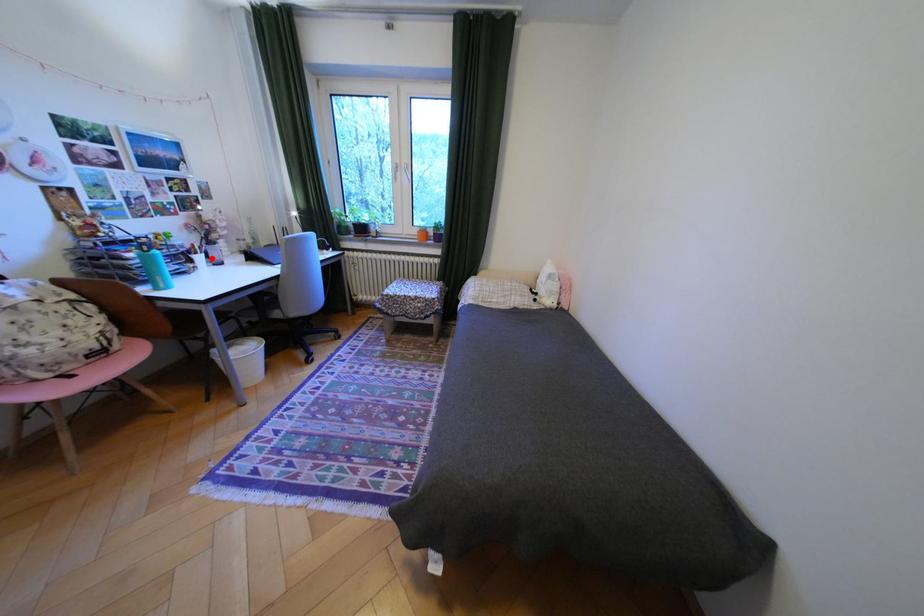
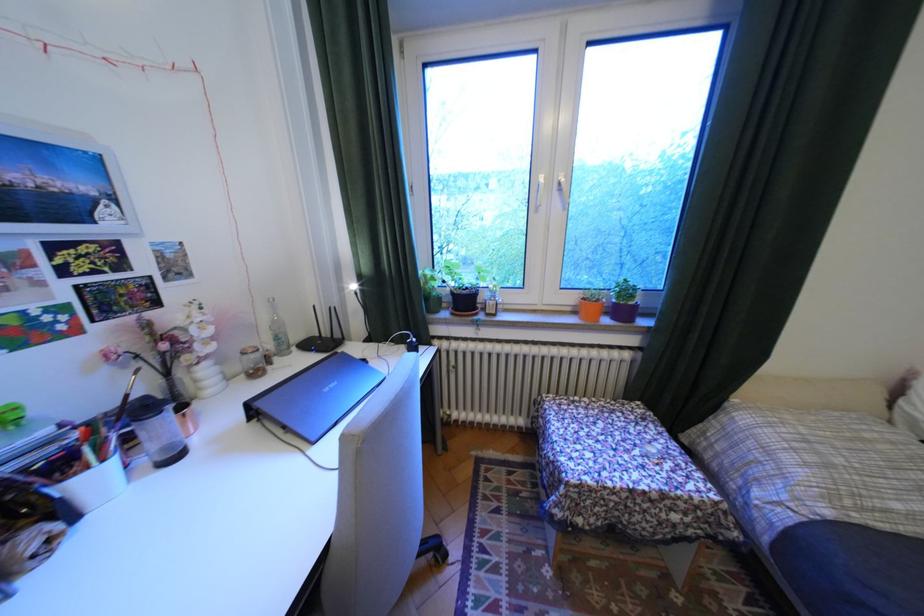
Find the pixel in the second image that matches the highlighted location in the first image.

(106, 479)